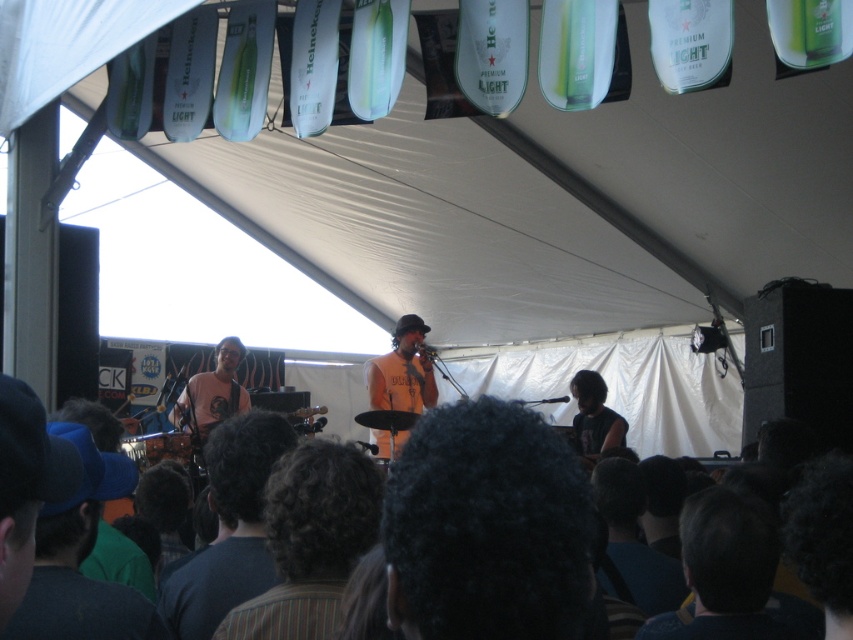
Between point (360, 468) and point (396, 346), which one is positioned behind?

Positioned behind is point (396, 346).

Is brown striped shirt at center taller than orange cotton shirt at center?

No, brown striped shirt at center is not taller than orange cotton shirt at center.

Between point (341, 531) and point (422, 381), which one is positioned in front?

Point (341, 531) is in front.

Find the location of a particular element. The width and height of the screenshot is (853, 640). brown striped shirt at center is located at coordinates (310, 540).

Does brown striped shirt at center have a lesser height compared to dark brown hair at lower center?

Yes.

Can you confirm if brown striped shirt at center is positioned to the left of dark brown hair at lower center?

In fact, brown striped shirt at center is to the right of dark brown hair at lower center.

Which is in front, point (300, 509) or point (231, 426)?

Point (300, 509)

Where is `brown striped shirt at center`? This screenshot has width=853, height=640. brown striped shirt at center is located at coordinates (310, 540).

Does blue fabric cap at lower left appear on the right side of orange cotton shirt at center?

Incorrect, blue fabric cap at lower left is not on the right side of orange cotton shirt at center.

Can you confirm if blue fabric cap at lower left is wider than orange cotton shirt at center?

No.

Who is more distant from viewer, (55,592) or (372,372)?

Positioned behind is point (372,372).

You are a GUI agent. You are given a task and a screenshot of the screen. Output one action in this format:
    pyautogui.click(x=<x>, y=<y>)
    Task: Click on the blue fabric cap at lower left
    
    Given the screenshot: What is the action you would take?
    pyautogui.click(x=80, y=560)